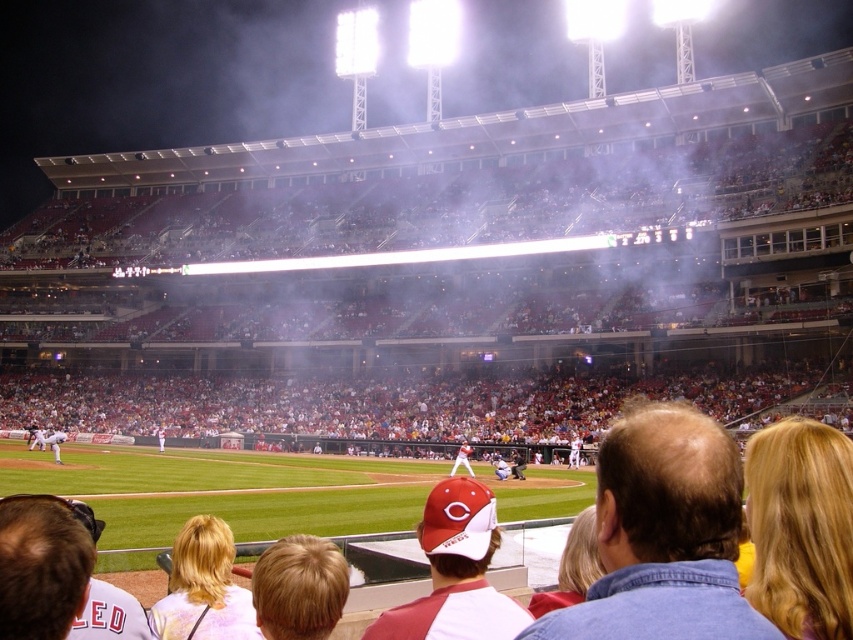
Where is `white jersey at center`? The width and height of the screenshot is (853, 640). white jersey at center is located at coordinates (x=462, y=458).

Image resolution: width=853 pixels, height=640 pixels. I want to click on white jersey at center, so click(462, 458).

The height and width of the screenshot is (640, 853). What do you see at coordinates (202, 588) in the screenshot?
I see `blonde hair at lower center` at bounding box center [202, 588].

Does point (173, 596) come behind point (51, 445)?

That is False.

Identify the location of blonde hair at lower center. The height and width of the screenshot is (640, 853). (202, 588).

Can you confirm if white plastic seats at center is positioned above white jersey at center?

Yes.

Which is above, white plastic seats at center or white jersey at center?

Positioned higher is white plastic seats at center.

Is point (630, 360) behind point (465, 465)?

That is True.

The image size is (853, 640). I want to click on white plastic seats at center, so click(x=457, y=269).